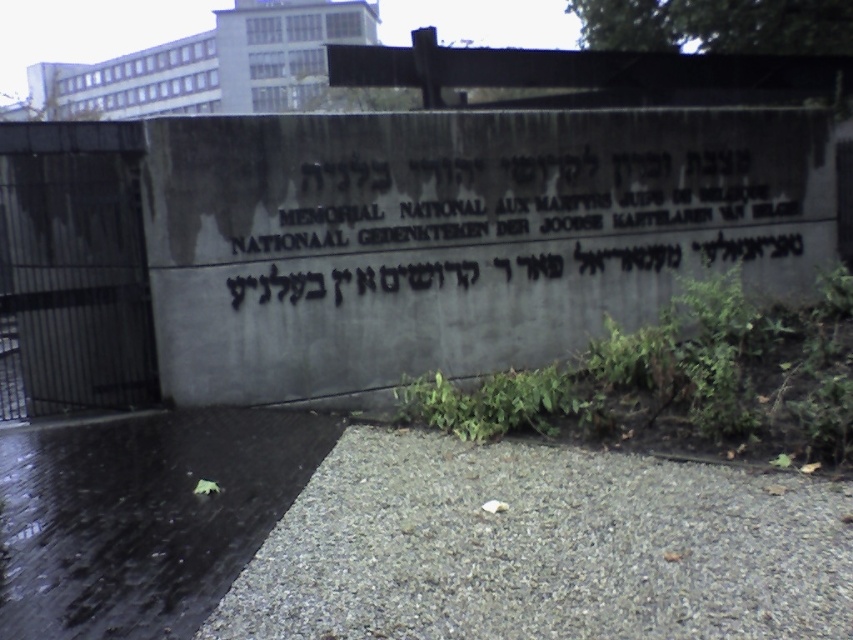
You are standing in front of the memorial wall and want to place a wreath exactly at the center of the dark gray stone sign at center. According to the coordinates provided, where should you place it?

The dark gray stone sign at center is positioned at coordinates point (511, 220), so you should place the wreath there.

You are standing in front of the memorial wall and want to place a flower at the base of the dark gray stone sign at center. However, there is a green leafy plant at lower right nearby. Which object is closer to you so you can reach it first?

The dark gray stone sign at center is closer to you than the green leafy plant at lower right, so you can reach it first to place the flower.

You are standing in front of the memorial wall and want to place a small decorative pot between the dark gray stone sign at center and the green leafy plant at lower right. Which object should the pot be closer to if it needs to be placed at the same height as the shorter object?

The pot should be placed closer to the green leafy plant at lower right because the dark gray stone sign at center is taller than the green leafy plant at lower right, making the plant the shorter object.